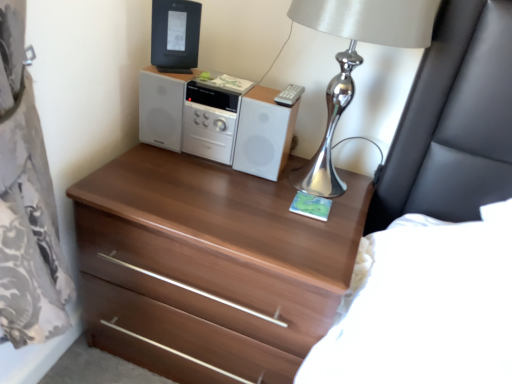
At what (x,y) coordinates should I click in order to perform the action: click on vacant area that is in front of silver metallic table lamp at upper right. Please return your answer as a coordinate pair (x, y). Image resolution: width=512 pixels, height=384 pixels. Looking at the image, I should click on (285, 241).